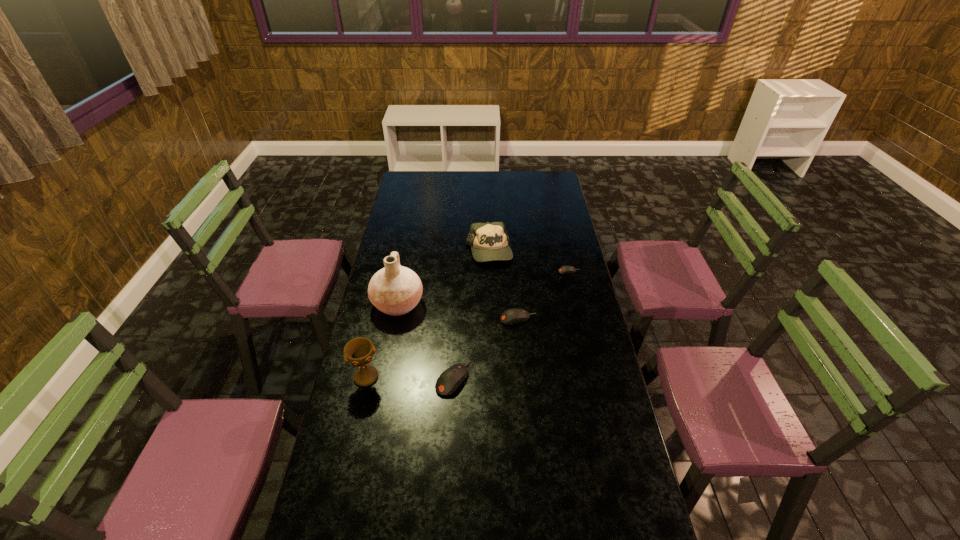
Image resolution: width=960 pixels, height=540 pixels. I want to click on the leftmost computer mouse, so click(449, 381).

Identify the location of the second computer mouse from right to left. Image resolution: width=960 pixels, height=540 pixels. (511, 316).

This screenshot has height=540, width=960. I want to click on the second farthest computer mouse, so click(x=511, y=316).

Find the location of a particular element. The height and width of the screenshot is (540, 960). the rightmost computer mouse is located at coordinates (566, 269).

The height and width of the screenshot is (540, 960). What are the coordinates of `the shortest computer mouse` in the screenshot? It's located at [x=566, y=269].

Where is `the farthest object`? This screenshot has width=960, height=540. the farthest object is located at coordinates (489, 241).

Identify the location of the third tallest object. (489, 241).

This screenshot has width=960, height=540. I want to click on chalice, so click(359, 351).

This screenshot has height=540, width=960. Find the location of `the tallest object`. the tallest object is located at coordinates [395, 290].

Where is `vacant region located on the back of the leftmost computer mouse`? vacant region located on the back of the leftmost computer mouse is located at coordinates (455, 348).